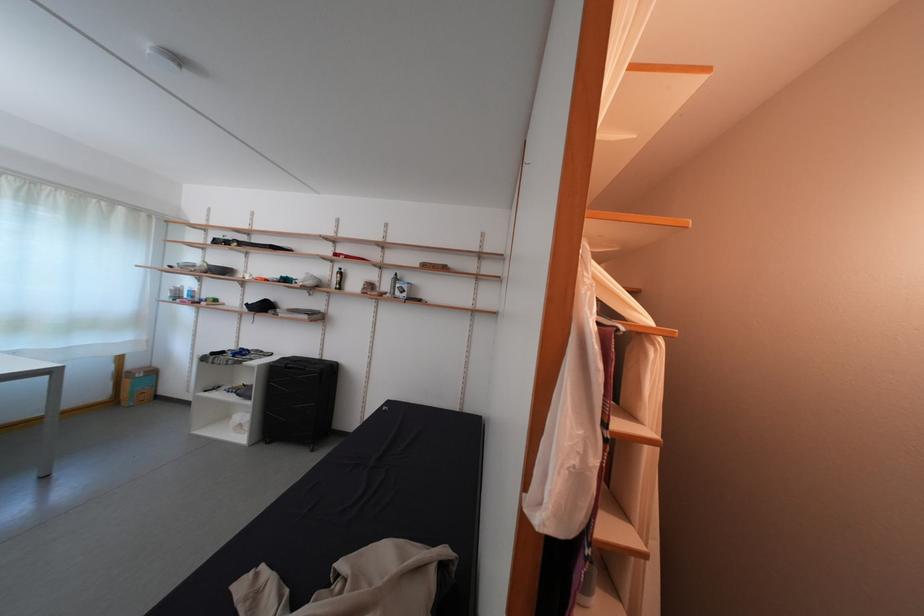
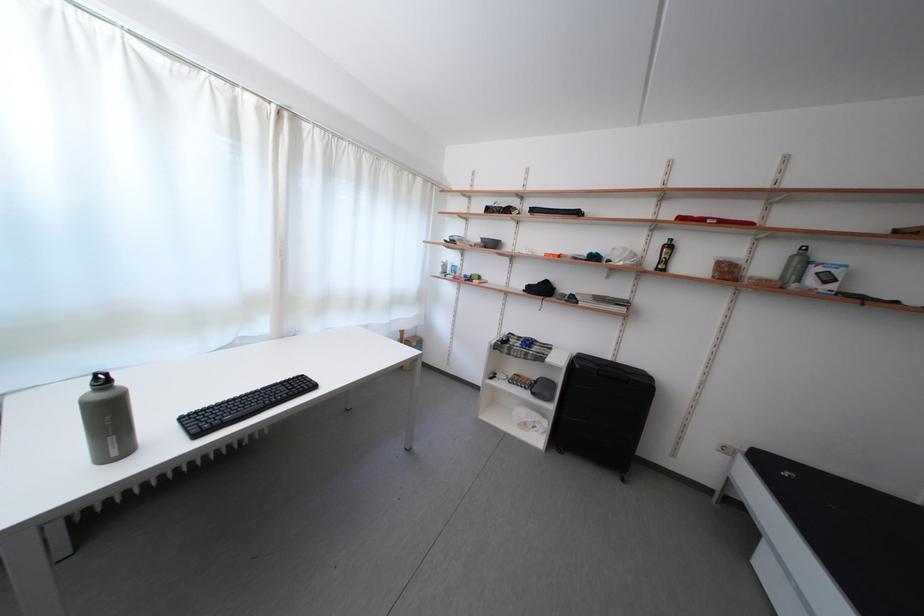
Locate, in the second image, the point that corresponds to point 325,362 in the first image.

(617, 363)